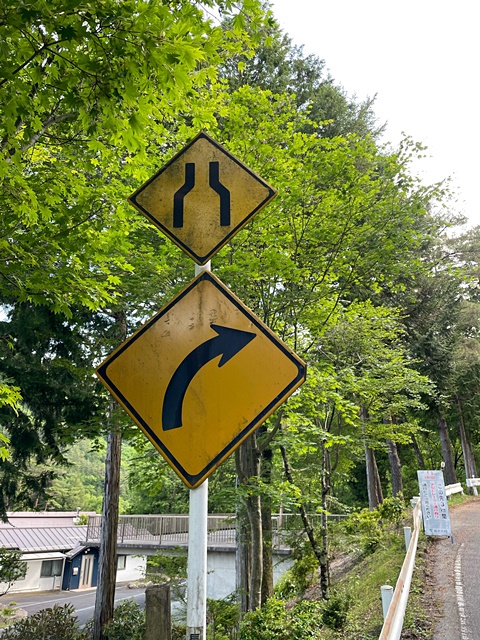
What are the coordinates of `windows in door` in the screenshot? It's located at (89, 564), (85, 570).